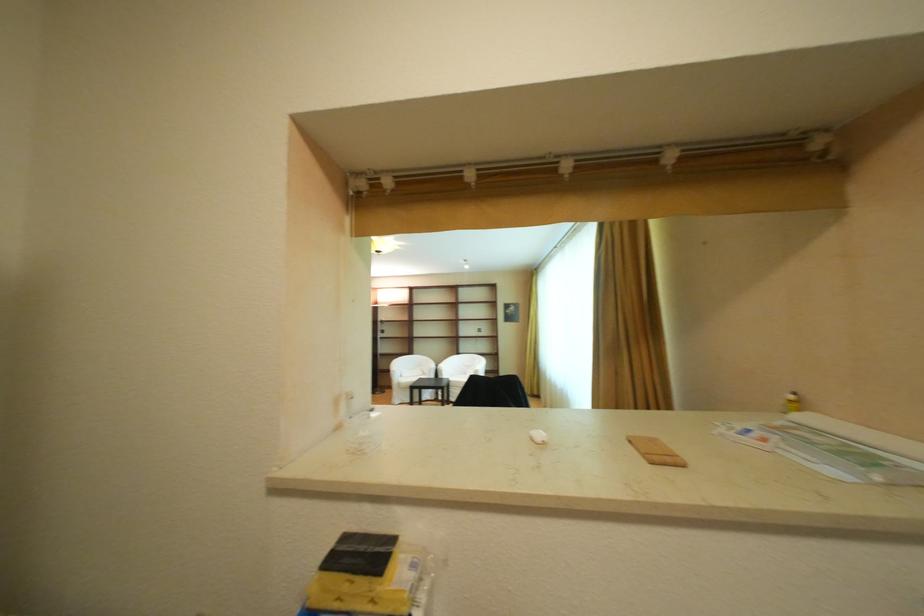
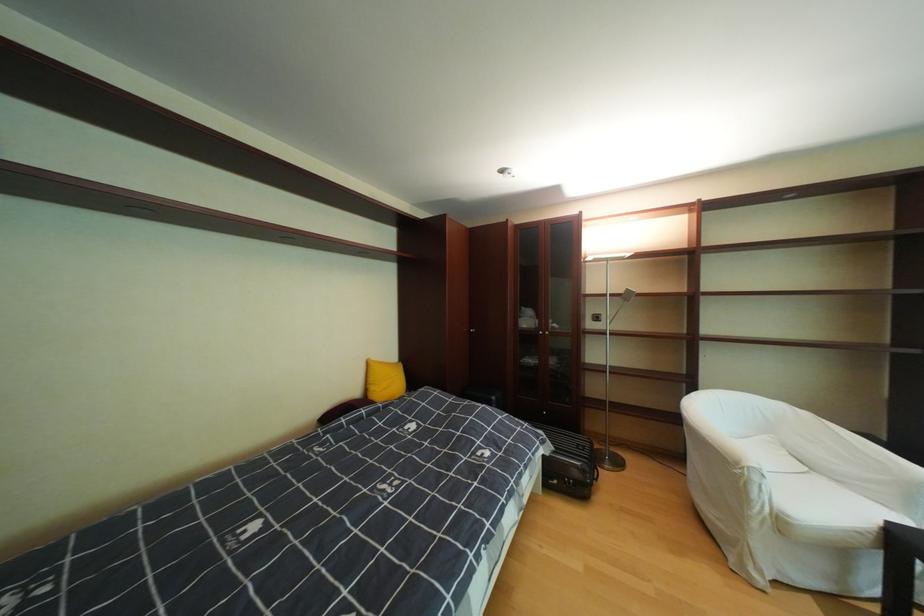
What movement of the cameraman would produce the second image?

The cameraman moved toward left, forward.